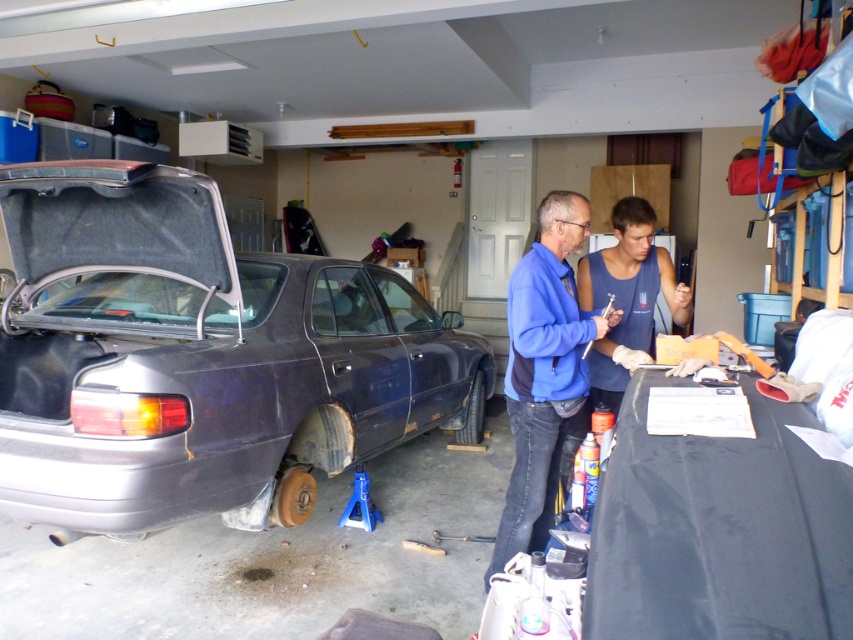
You are a mechanic in the garage and need to place the blue fleece jacket at center on top of the matte dark gray car at left. Will the jacket fit entirely on the car without hanging off the sides?

The matte dark gray car at left has a lesser height compared to blue fleece jacket at center, so the jacket might not fit entirely on the car as the car is shorter in height than the jacket.

You are a mechanic who needs to reach the blue fleece jacket at center to keep warm while working on the matte dark gray car at left. Can you comfortably walk between them without needing to move any items?

The distance between the matte dark gray car at left and the blue fleece jacket at center is 1.44 meters. Since this distance is sufficient for a person to walk through comfortably, you can reach the jacket without moving any items.

You are a mechanic trying to access the trunk of the matte dark gray car at left and the blue cotton tank top at center. Which object is closer to the garage entrance located on the right side of the image?

The blue cotton tank top at center is closer to the garage entrance on the right side because the matte dark gray car at left is positioned on its left side, placing the tank top nearer to the entrance.